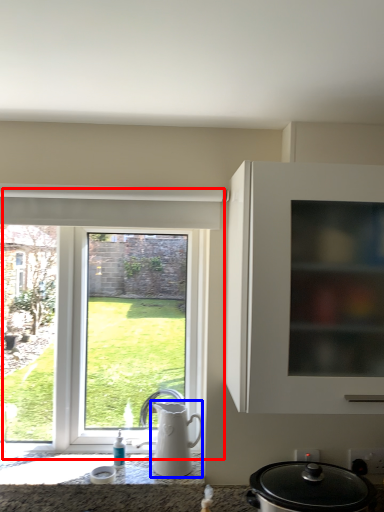
Question: Among these objects, which one is farthest to the camera, window (highlighted by a red box) or jug (highlighted by a blue box)?

Choices:
 (A) window
 (B) jug

Answer: (A)